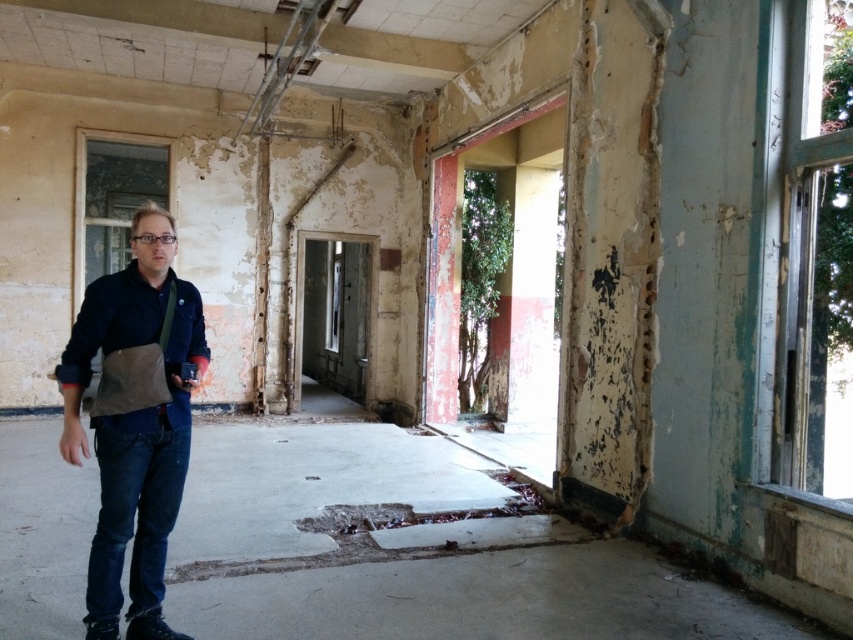
Question: Which point is closer to the camera taking this photo?

Choices:
 (A) (177, 358)
 (B) (175, 336)

Answer: (B)

Question: Is dark blue denim jacket at center to the left of denim jacket at left from the viewer's perspective?

Choices:
 (A) no
 (B) yes

Answer: (B)

Question: Among these points, which one is nearest to the camera?

Choices:
 (A) (74, 376)
 (B) (137, 321)

Answer: (A)

Question: Does dark blue denim jacket at center lie in front of denim jacket at left?

Choices:
 (A) no
 (B) yes

Answer: (B)

Question: Is dark blue denim jacket at center to the left of denim jacket at left from the viewer's perspective?

Choices:
 (A) no
 (B) yes

Answer: (B)